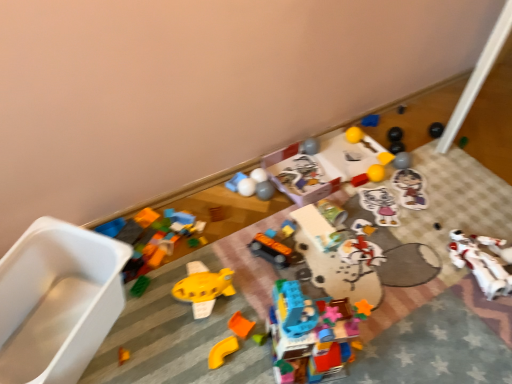
Locate an element on the screen. The image size is (512, 384). free space to the back side of orange matte plastic toy at lower center, the third toy when ordered from left to right is located at coordinates (231, 305).